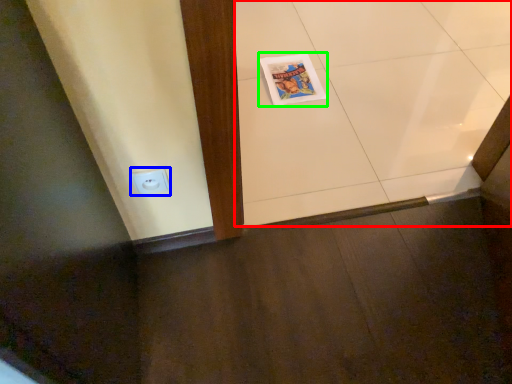
Question: Which object is positioned farthest from ceramic tile (highlighted by a red box)? Select from electric outlet (highlighted by a blue box) and comic book (highlighted by a green box).

Choices:
 (A) electric outlet
 (B) comic book

Answer: (A)